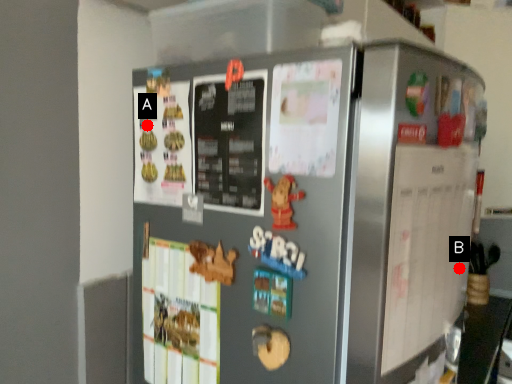
Question: Two points are circled on the image, labeled by A and B beside each circle. Which point is closer to the camera?

Choices:
 (A) A is closer
 (B) B is closer

Answer: (B)